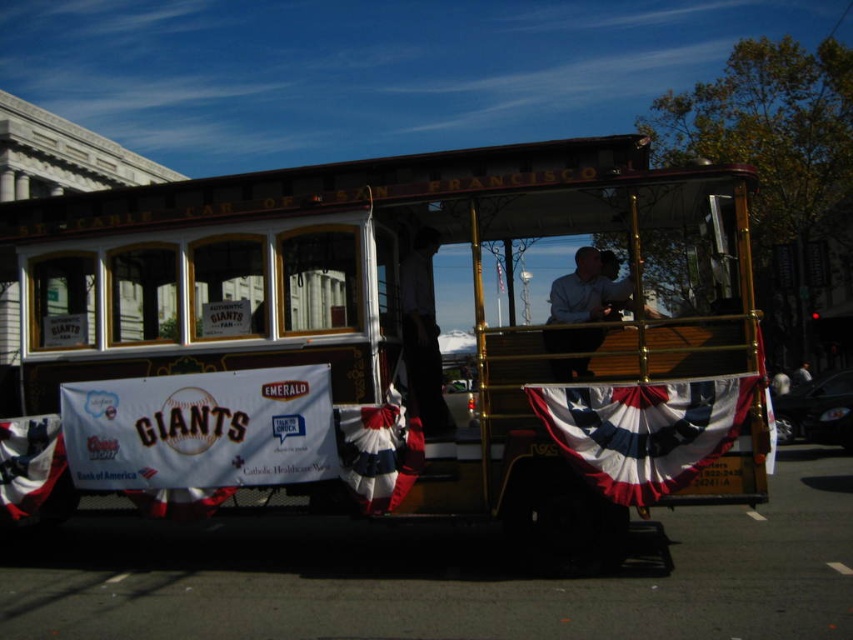
Which of these two, red-white-blue fabric banner at center or red fabric flag at lower left, stands taller?

red-white-blue fabric banner at center

Is point (654, 464) behind point (28, 460)?

No, (654, 464) is in front of (28, 460).

The height and width of the screenshot is (640, 853). In order to click on red-white-blue fabric banner at center in this screenshot , I will do `click(645, 429)`.

Does wooden cable car at center have a larger size compared to red-white-blue fabric banner at center?

Indeed, wooden cable car at center has a larger size compared to red-white-blue fabric banner at center.

Which is behind, point (209, 413) or point (598, 416)?

Positioned behind is point (209, 413).

The height and width of the screenshot is (640, 853). Identify the location of wooden cable car at center. (393, 344).

Which is in front, point (294, 339) or point (22, 480)?

Point (294, 339) is more forward.

Based on the photo, is wooden cable car at center wider than red fabric flag at lower left?

Yes.

Is point (25, 404) farther from camera compared to point (15, 472)?

Yes.

Locate an element on the screen. wooden cable car at center is located at coordinates (393, 344).